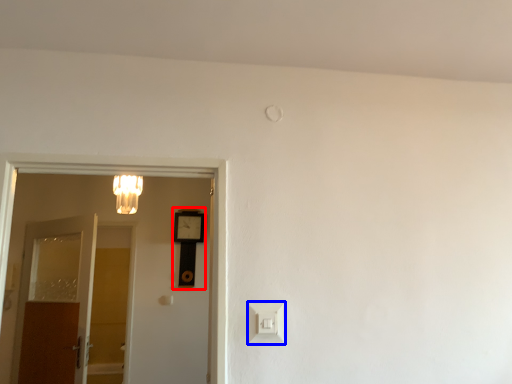
Question: Which object appears farthest to the camera in this image, clock (highlighted by a red box) or light switch (highlighted by a blue box)?

Choices:
 (A) clock
 (B) light switch

Answer: (A)